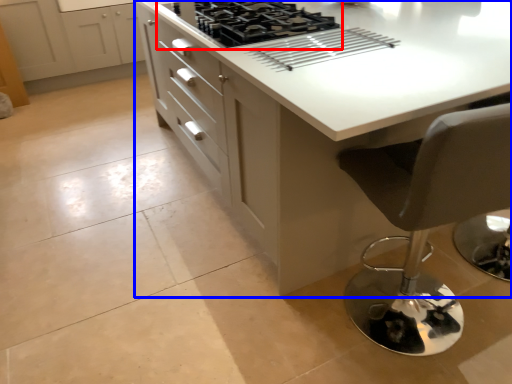
Question: Which object is further to the camera taking this photo, gas stove (highlighted by a red box) or countertop (highlighted by a blue box)?

Choices:
 (A) gas stove
 (B) countertop

Answer: (A)